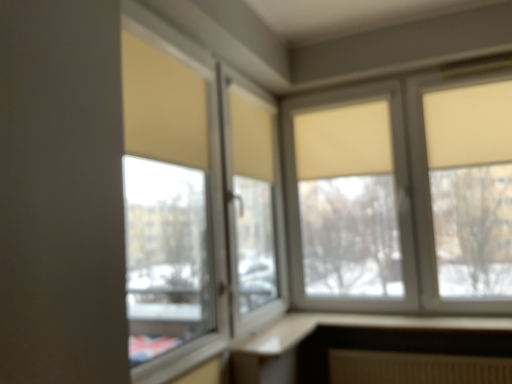
Where is `free location above matte beige roller blinds at upper right, which is counted as the 2th window, starting from the front (from a real-world perspective)`? This screenshot has width=512, height=384. free location above matte beige roller blinds at upper right, which is counted as the 2th window, starting from the front (from a real-world perspective) is located at coordinates (380, 81).